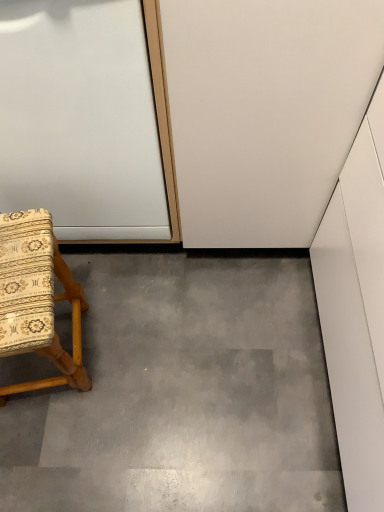
Question: In terms of width, does gray concrete at lower left look wider or thinner when compared to wooden-patterned fabric chair at lower left?

Choices:
 (A) thin
 (B) wide

Answer: (B)

Question: In the image, is gray concrete at lower left on the left side or the right side of wooden-patterned fabric chair at lower left?

Choices:
 (A) right
 (B) left

Answer: (A)

Question: Which object is the closest to the white glossy door at upper left?

Choices:
 (A) gray concrete at lower left
 (B) wooden-patterned fabric chair at lower left

Answer: (B)

Question: Which of these objects is positioned closest to the wooden-patterned fabric chair at lower left?

Choices:
 (A) white glossy door at upper left
 (B) gray concrete at lower left

Answer: (A)